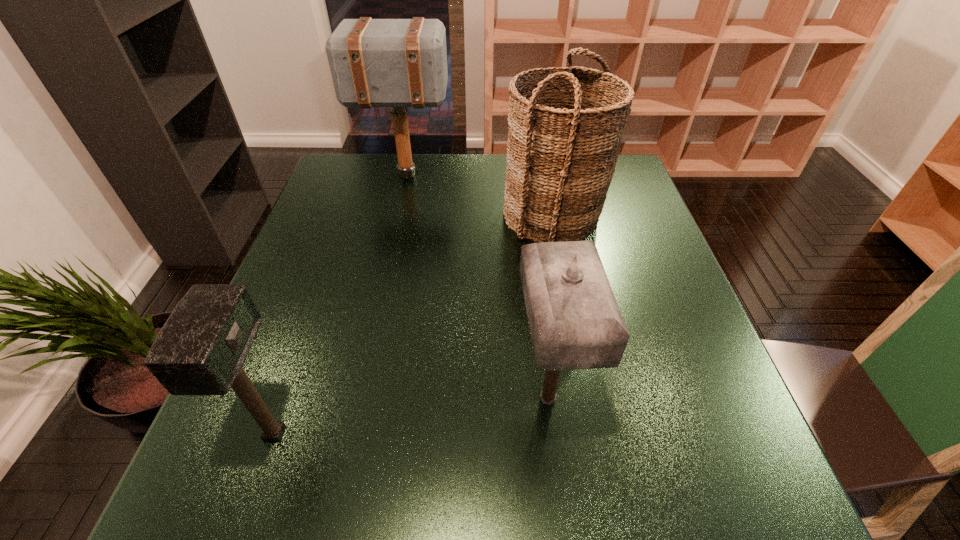
Where is `the farthest mallet`? The width and height of the screenshot is (960, 540). the farthest mallet is located at coordinates (398, 63).

You are a GUI agent. You are given a task and a screenshot of the screen. Output one action in this format:
    pyautogui.click(x=<x>, y=<y>)
    Task: Click on the basket
    This screenshot has height=540, width=960.
    Given the screenshot: What is the action you would take?
    pos(565,130)

Locate an element on the screen. This screenshot has height=540, width=960. the rightmost mallet is located at coordinates (575, 323).

This screenshot has height=540, width=960. Find the location of `the shortest object`. the shortest object is located at coordinates (200, 350).

This screenshot has height=540, width=960. I want to click on vacant space located on the striking surface of the farthest mallet, so pos(500,175).

Image resolution: width=960 pixels, height=540 pixels. I want to click on free space located on the left of the basket, so click(x=385, y=215).

The image size is (960, 540). Identify the location of free space located on the left of the rightmost mallet. (313, 399).

Where is `free space located 0.110m on the back of the shortest mallet`? This screenshot has width=960, height=540. free space located 0.110m on the back of the shortest mallet is located at coordinates (303, 351).

What are the coordinates of `mallet that is positioned at the far edge` in the screenshot? It's located at (398, 63).

At what (x,y) coordinates should I click in order to perform the action: click on basket at the far edge. Please return your answer as a coordinate pair (x, y). The width and height of the screenshot is (960, 540). Looking at the image, I should click on (565, 130).